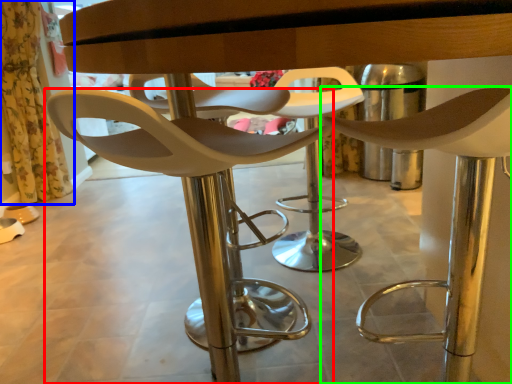
Question: Considering the real-world distances, which object is farthest from chair (highlighted by a red box)? curtain (highlighted by a blue box) or chair (highlighted by a green box)?

Choices:
 (A) curtain
 (B) chair

Answer: (A)